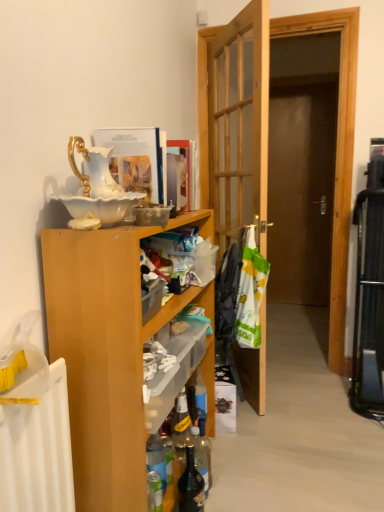
I want to click on white plastic laundry at center, which ranks as the second laundry in front-to-back order, so click(243, 307).

This screenshot has height=512, width=384. Describe the element at coordinates (243, 307) in the screenshot. I see `white plastic laundry at center, which ranks as the second laundry in front-to-back order` at that location.

Image resolution: width=384 pixels, height=512 pixels. Find the location of `matte paper magazine at upper center, the 2th magazine from the left`. matte paper magazine at upper center, the 2th magazine from the left is located at coordinates (182, 174).

The height and width of the screenshot is (512, 384). I want to click on wooden cabinet at left, so click(104, 355).

Describe the element at coordinates (181, 376) in the screenshot. The width and height of the screenshot is (384, 512). I see `translucent plastic shelf at center` at that location.

What do you see at coordinates (156, 458) in the screenshot? I see `translucent glass bottle at lower center, which appears as the first bottle when viewed from the left` at bounding box center [156, 458].

The width and height of the screenshot is (384, 512). What do you see at coordinates (235, 122) in the screenshot? I see `wooden door at center` at bounding box center [235, 122].

In order to click on white plastic laundry at center, which ranks as the second laundry in front-to-back order in this screenshot , I will do [x=243, y=307].

From a real-world perspective, which is physically above, white glossy book at upper center, which is the first magazine in left-to-right order, or white plastic bag at center, the 1th laundry in the front-to-back sequence?

In real-world perspective, white glossy book at upper center, which is the first magazine in left-to-right order, is above.

What's the angular difference between white glossy book at upper center, the second magazine from the right, and white plastic bag at center, the 1th laundry in the front-to-back sequence,'s facing directions?

29.7 degrees separate the facing orientations of white glossy book at upper center, the second magazine from the right, and white plastic bag at center, the 1th laundry in the front-to-back sequence.

Considering the points (138, 144) and (239, 290), which point is in front, point (138, 144) or point (239, 290)?

The point (138, 144) is in front.

Would you say white glossy book at upper center, the first magazine positioned from the front, is outside white plastic bag at center, the 1th laundry in the front-to-back sequence?

Absolutely, white glossy book at upper center, the first magazine positioned from the front, is external to white plastic bag at center, the 1th laundry in the front-to-back sequence.

Is translucent plastic shelf at center facing away from wooden door at center?

No, translucent plastic shelf at center's orientation is not away from wooden door at center.

Which object is wider, translucent plastic shelf at center or wooden door at center?

wooden door at center.

From the picture: From the image's perspective, between translucent plastic shelf at center and wooden door at center, who is located below?

From the image's view, translucent plastic shelf at center is below.

From a real-world perspective, is translucent plastic shelf at center above or below wooden door at center?

translucent plastic shelf at center is situated lower than wooden door at center in the real world.

Which of these two, wooden cabinet at left or dark glass bottle at lower center, which is the 1th bottle in right-to-left order, is smaller?

dark glass bottle at lower center, which is the 1th bottle in right-to-left order, is smaller.

From a real-world perspective, is wooden cabinet at left positioned under dark glass bottle at lower center, which is the 1th bottle in right-to-left order, based on gravity?

No, from a real-world perspective, wooden cabinet at left is not below dark glass bottle at lower center, which is the 1th bottle in right-to-left order.

Is wooden cabinet at left facing towards dark glass bottle at lower center, which is the 1th bottle in right-to-left order?

Yes, wooden cabinet at left faces towards dark glass bottle at lower center, which is the 1th bottle in right-to-left order.

Between point (195, 212) and point (187, 507), which one is positioned in front?

The point (187, 507) is in front.

Where is `the 1st magazine above the wooden cabinet at left (from the image's perspective)`? This screenshot has width=384, height=512. the 1st magazine above the wooden cabinet at left (from the image's perspective) is located at coordinates (135, 159).

Between wooden cabinet at left and white glossy book at upper center, which is the first magazine in left-to-right order, which one has larger size?

With larger size is wooden cabinet at left.

Would you say wooden cabinet at left is a long distance from white glossy book at upper center, which is the 2th magazine in back-to-front order?

No.

Does wooden cabinet at left have a greater width compared to white glossy book at upper center, which is the first magazine in left-to-right order?

Correct, the width of wooden cabinet at left exceeds that of white glossy book at upper center, which is the first magazine in left-to-right order.

Considering the sizes of objects translucent plastic shelf at center and white plastic laundry at center, the first laundry viewed from the back, in the image provided, who is shorter, translucent plastic shelf at center or white plastic laundry at center, the first laundry viewed from the back,?

With less height is translucent plastic shelf at center.

Measure the distance between translucent plastic shelf at center and white plastic laundry at center, the first laundry viewed from the back.

translucent plastic shelf at center and white plastic laundry at center, the first laundry viewed from the back, are 12.12 inches apart from each other.

Which object is further away from the camera, translucent plastic shelf at center or white plastic laundry at center, which ranks as the second laundry in front-to-back order?

white plastic laundry at center, which ranks as the second laundry in front-to-back order.

You are a GUI agent. You are given a task and a screenshot of the screen. Output one action in this format:
    pyautogui.click(x=<x>, y=<y>)
    Task: Click on the shelf that appears below the white plastic laundry at center, the first laundry viewed from the back (from the image's perspective)
    Image resolution: width=384 pixels, height=512 pixels.
    Given the screenshot: What is the action you would take?
    pyautogui.click(x=181, y=376)

Is the position of matte paper magazine at upper center, the second magazine in the front-to-back sequence, more distant than that of translucent glass bottle at lower center, which appears as the first bottle when viewed from the left?

Yes, matte paper magazine at upper center, the second magazine in the front-to-back sequence, is further from the camera.

Does matte paper magazine at upper center, the second magazine in the front-to-back sequence, have a lesser height compared to translucent glass bottle at lower center, which appears as the first bottle when viewed from the left?

Incorrect, the height of matte paper magazine at upper center, the second magazine in the front-to-back sequence, does not fall short of that of translucent glass bottle at lower center, which appears as the first bottle when viewed from the left.

Which is farther from the camera, (193, 144) or (149, 453)?

Point (193, 144)

From the picture: Is matte paper magazine at upper center, the 2th magazine from the left, wider than wooden door at center?

No.

What's the angular difference between matte paper magazine at upper center, the 1th magazine from the right, and wooden door at center's facing directions?

The angle between the facing direction of matte paper magazine at upper center, the 1th magazine from the right, and the facing direction of wooden door at center is 36.6 degrees.

Locate an element on the screen. The height and width of the screenshot is (512, 384). door below the matte paper magazine at upper center, the 2th magazine from the left (from the image's perspective) is located at coordinates [x=235, y=122].

Considering the positions of points (167, 152) and (234, 197), is point (167, 152) farther from camera compared to point (234, 197)?

No, (167, 152) is closer to viewer.

Identify the location of the 2nd laundry to the right of the white glossy book at upper center, which is the 2th magazine in back-to-front order, counting from the anchor's position. This screenshot has width=384, height=512. (250, 293).

Find the location of a particular element. This screenshot has height=512, width=384. door above the translucent plastic shelf at center (from the image's perspective) is located at coordinates (235, 122).

Consider the image. From the image, which object appears to be nearer to dark glass bottle at lower center, positioned as the 2th bottle in left-to-right order, white plastic bag at center, the second laundry from the back, or translucent plastic shelf at center?

Based on the image, translucent plastic shelf at center appears to be nearer to dark glass bottle at lower center, positioned as the 2th bottle in left-to-right order.

Estimate the real-world distances between objects in this image. Which object is closer to dark glass bottle at lower center, which is the 1th bottle in right-to-left order, matte paper magazine at upper center, the 1th magazine from the right, or translucent plastic shelf at center?

translucent plastic shelf at center is positioned closer to the anchor dark glass bottle at lower center, which is the 1th bottle in right-to-left order.

Considering their positions, is translucent plastic shelf at center positioned further to dark glass bottle at lower center, which is the 1th bottle in right-to-left order, than wooden cabinet at left?

wooden cabinet at left is positioned further to the anchor dark glass bottle at lower center, which is the 1th bottle in right-to-left order.

Estimate the real-world distances between objects in this image. Which object is closer to white plastic laundry at center, the first laundry viewed from the back, white plastic bag at center, the 1th laundry in the front-to-back sequence, or translucent glass bottle at lower center, which appears as the first bottle when viewed from the left?

white plastic bag at center, the 1th laundry in the front-to-back sequence, is closer to white plastic laundry at center, the first laundry viewed from the back.

Looking at the image, which one is located closer to translucent glass bottle at lower center, marked as the second bottle in a right-to-left arrangement, translucent plastic shelf at center or white plastic laundry at center, the first laundry viewed from the back?

Based on the image, translucent plastic shelf at center appears to be nearer to translucent glass bottle at lower center, marked as the second bottle in a right-to-left arrangement.

Based on their spatial positions, is translucent plastic shelf at center or wooden door at center closer to dark glass bottle at lower center, positioned as the 2th bottle in left-to-right order?

Based on the image, translucent plastic shelf at center appears to be nearer to dark glass bottle at lower center, positioned as the 2th bottle in left-to-right order.

Estimate the real-world distances between objects in this image. Which object is closer to dark glass bottle at lower center, positioned as the 2th bottle in left-to-right order, translucent plastic shelf at center or white plastic laundry at center, which ranks as the second laundry in front-to-back order?

The object closer to dark glass bottle at lower center, positioned as the 2th bottle in left-to-right order, is translucent plastic shelf at center.

Estimate the real-world distances between objects in this image. Which object is closer to matte paper magazine at upper center, which is the first magazine in back-to-front order, translucent plastic shelf at center or wooden door at center?

translucent plastic shelf at center lies closer to matte paper magazine at upper center, which is the first magazine in back-to-front order, than the other object.

What are the coordinates of `shelf positioned between wooden cabinet at left and white plastic bag at center, the second laundry from the back, from near to far` in the screenshot? It's located at (181, 376).

Identify the location of door between matte paper magazine at upper center, the second magazine in the front-to-back sequence, and white plastic laundry at center, which ranks as the second laundry in front-to-back order, in the vertical direction. (235, 122).

The width and height of the screenshot is (384, 512). What are the coordinates of `door that lies between matte paper magazine at upper center, the 1th magazine from the right, and translucent glass bottle at lower center, marked as the second bottle in a right-to-left arrangement, from top to bottom` in the screenshot? It's located at (235, 122).

Find the location of a particular element. shelf between wooden door at center and translucent glass bottle at lower center, which appears as the first bottle when viewed from the left, in the vertical direction is located at coordinates (181, 376).